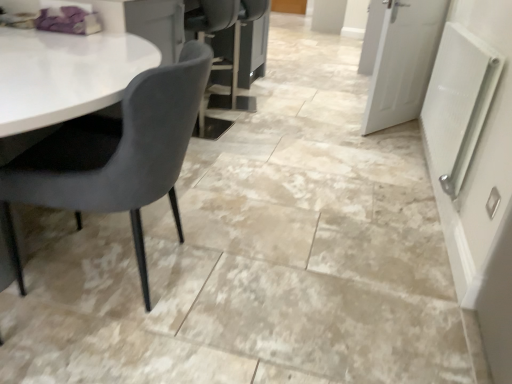
I want to click on vacant area that is in front of velvet grey chair at left, so click(x=100, y=349).